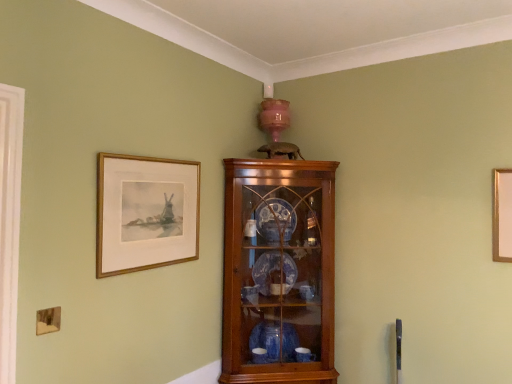
Describe the element at coordinates (278, 271) in the screenshot. I see `wooden cabinet at upper center` at that location.

I want to click on wooden cabinet at upper center, so click(278, 271).

What do you see at coordinates (145, 213) in the screenshot? This screenshot has width=512, height=384. I see `wooden framed print at upper left` at bounding box center [145, 213].

What is the approximate width of wooden framed print at upper left?

The width of wooden framed print at upper left is 1.56 inches.

Where is `wooden framed print at upper left`? wooden framed print at upper left is located at coordinates (145, 213).

You are a GUI agent. You are given a task and a screenshot of the screen. Output one action in this format:
    pyautogui.click(x=<x>, y=<y>)
    Task: Click on the wooden cabinet at upper center
    This screenshot has width=512, height=384.
    Given the screenshot: What is the action you would take?
    pyautogui.click(x=278, y=271)

Is wooden cabinet at upper center to the left of wooden framed print at upper left from the viewer's perspective?

Incorrect, wooden cabinet at upper center is not on the left side of wooden framed print at upper left.

Considering the positions of objects wooden cabinet at upper center and wooden framed print at upper left in the image provided, who is behind, wooden cabinet at upper center or wooden framed print at upper left?

wooden cabinet at upper center.

Considering the positions of point (228, 204) and point (99, 167), is point (228, 204) closer or farther from the camera than point (99, 167)?

Clearly, point (228, 204) is more distant from the camera than point (99, 167).

From the image's perspective, between wooden cabinet at upper center and wooden framed print at upper left, which one is located above?

wooden framed print at upper left.

From a real-world perspective, is wooden cabinet at upper center above or below wooden framed print at upper left?

wooden cabinet at upper center is below wooden framed print at upper left.

Does wooden cabinet at upper center have a lesser width compared to wooden framed print at upper left?

In fact, wooden cabinet at upper center might be wider than wooden framed print at upper left.

Is wooden cabinet at upper center taller or shorter than wooden framed print at upper left?

wooden cabinet at upper center is taller than wooden framed print at upper left.

Looking at this image, which of these two, wooden cabinet at upper center or wooden framed print at upper left, is bigger?

With larger size is wooden cabinet at upper center.

Could wooden framed print at upper left be considered to be inside wooden cabinet at upper center?

No, wooden framed print at upper left is not a part of wooden cabinet at upper center.

Are wooden cabinet at upper center and wooden framed print at upper left located far from each other?

No, wooden cabinet at upper center is not far from wooden framed print at upper left.

Is wooden cabinet at upper center aimed at wooden framed print at upper left?

No, wooden cabinet at upper center is not aimed at wooden framed print at upper left.

Can you tell me how much wooden cabinet at upper center and wooden framed print at upper left differ in facing direction?

There is a 46.7-degree angle between the facing directions of wooden cabinet at upper center and wooden framed print at upper left.

The height and width of the screenshot is (384, 512). What are the coordinates of `picture frame that is in front of the wooden cabinet at upper center` in the screenshot? It's located at (145, 213).

Can you confirm if wooden framed print at upper left is positioned to the left of wooden cabinet at upper center?

Indeed, wooden framed print at upper left is positioned on the left side of wooden cabinet at upper center.

Which is in front, wooden framed print at upper left or wooden cabinet at upper center?

wooden framed print at upper left is more forward.

Considering the positions of point (98, 277) and point (224, 324), is point (98, 277) closer or farther from the camera than point (224, 324)?

Clearly, point (98, 277) is closer to the camera than point (224, 324).

From the image's perspective, would you say wooden framed print at upper left is positioned over wooden cabinet at upper center?

Correct, wooden framed print at upper left appears higher than wooden cabinet at upper center in the image.

Based on the photo, from a real-world perspective, which is physically below, wooden framed print at upper left or wooden cabinet at upper center?

wooden cabinet at upper center.

Which of these two, wooden framed print at upper left or wooden cabinet at upper center, is thinner?

wooden framed print at upper left.

From their relative heights in the image, would you say wooden framed print at upper left is taller or shorter than wooden cabinet at upper center?

Clearly, wooden framed print at upper left is shorter compared to wooden cabinet at upper center.

Considering the sizes of objects wooden framed print at upper left and wooden cabinet at upper center in the image provided, who is smaller, wooden framed print at upper left or wooden cabinet at upper center?

Smaller between the two is wooden framed print at upper left.

Would you say wooden framed print at upper left is outside wooden cabinet at upper center?

Indeed, wooden framed print at upper left is completely outside wooden cabinet at upper center.

Is wooden framed print at upper left positioned far away from wooden cabinet at upper center?

No, wooden framed print at upper left is not far away from wooden cabinet at upper center.

Is wooden framed print at upper left facing away from wooden cabinet at upper center?

No, wooden cabinet at upper center is not at the back of wooden framed print at upper left.

How many degrees apart are the facing directions of wooden framed print at upper left and wooden cabinet at upper center?

The angle between the facing direction of wooden framed print at upper left and the facing direction of wooden cabinet at upper center is 46.7 degrees.

The image size is (512, 384). There is a wooden cabinet at upper center. In order to click on picture frame above it (from a real-world perspective) in this screenshot , I will do `click(145, 213)`.

The image size is (512, 384). Identify the location of picture frame positioned vertically above the wooden cabinet at upper center (from a real-world perspective). (145, 213).

Locate an element on the screen. picture frame on the left of wooden cabinet at upper center is located at coordinates (145, 213).